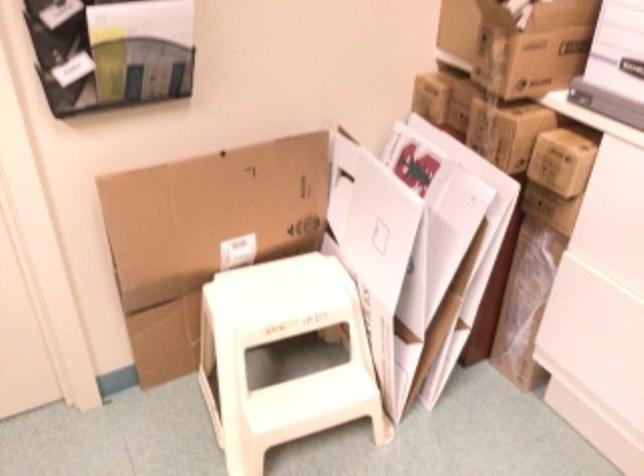
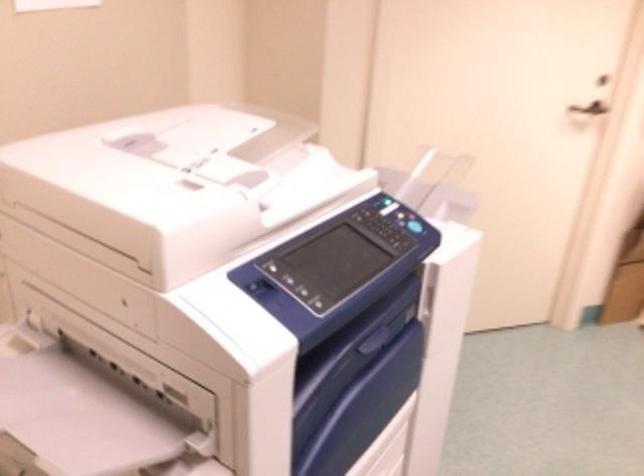
In a continuous first-person perspective shot, in which direction is the camera moving?

The movement direction of the cameraman is left, backward.